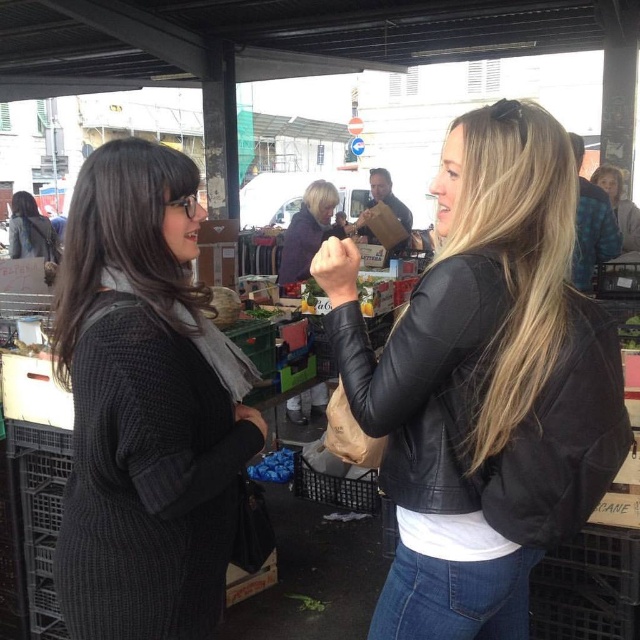
Question: Is dark gray knitted sweater at left to the right of dark gray sweater at upper left from the viewer's perspective?

Choices:
 (A) yes
 (B) no

Answer: (A)

Question: Among these points, which one is farthest from the camera?

Choices:
 (A) (28, 236)
 (B) (234, 358)

Answer: (A)

Question: From the image, what is the correct spatial relationship of dark gray knitted sweater at left in relation to dark gray sweater at upper left?

Choices:
 (A) right
 (B) left

Answer: (A)

Question: Which object appears farthest from the camera in this image?

Choices:
 (A) dark gray knitted sweater at left
 (B) black leather jacket at right
 (C) dark gray sweater at upper left

Answer: (C)

Question: Which of the following is the closest to the observer?

Choices:
 (A) (54, 252)
 (B) (177, 634)

Answer: (B)

Question: Can you confirm if dark gray knitted sweater at left is positioned below dark gray sweater at upper left?

Choices:
 (A) yes
 (B) no

Answer: (A)